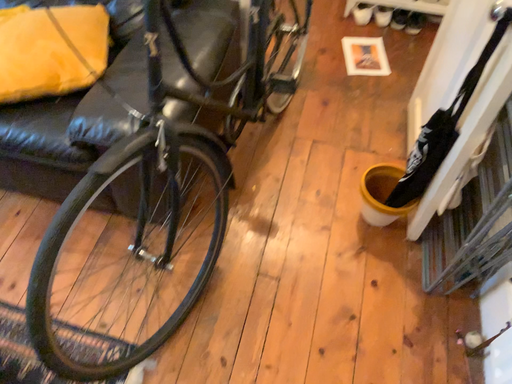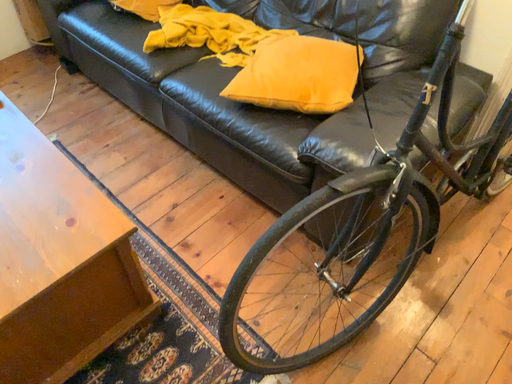
Question: Which way did the camera rotate in the video?

Choices:
 (A) rotated left
 (B) rotated right

Answer: (A)